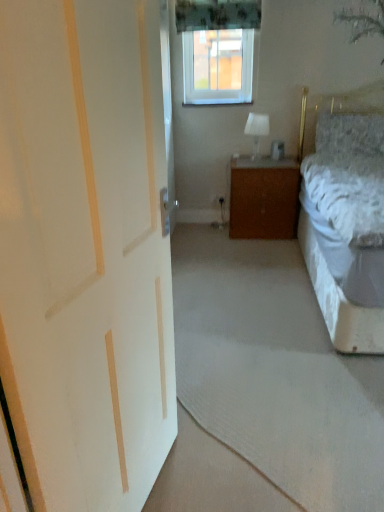
This screenshot has height=512, width=384. I want to click on unoccupied area in front of white fabric lampshade at upper center, so click(251, 159).